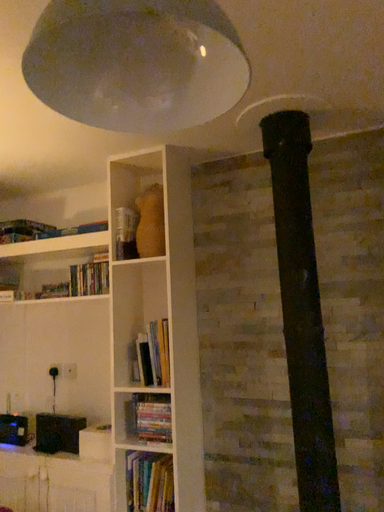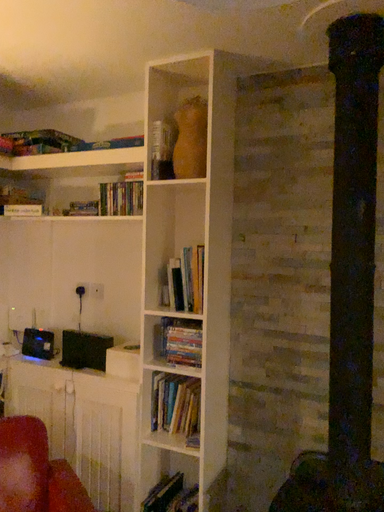
Question: Which way did the camera rotate in the video?

Choices:
 (A) rotated upward
 (B) rotated downward

Answer: (B)